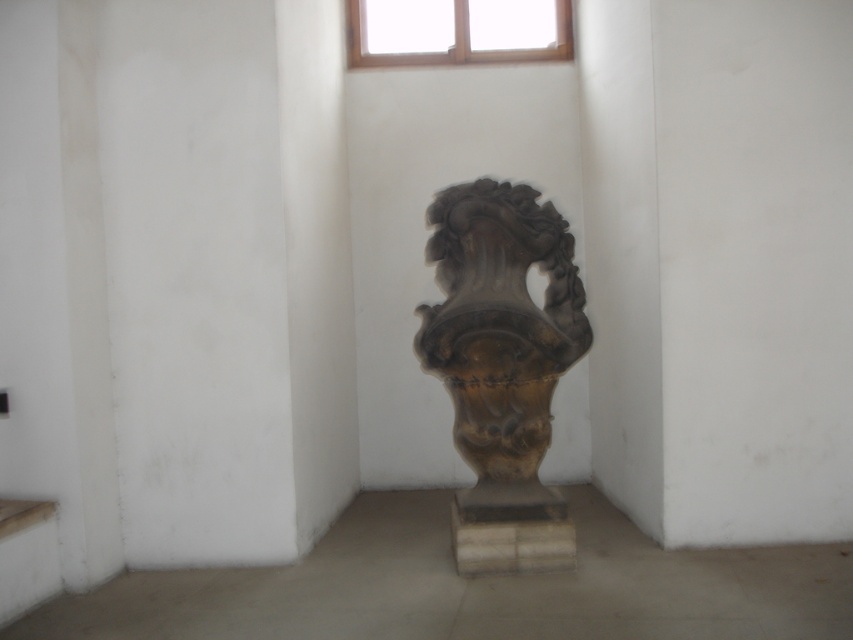
You are hanging a picture in a room. You see the brown stone vase at center and the wooden frame at upper center. Which object is located below the other?

The brown stone vase at center is positioned under the wooden frame at upper center, so the vase is below the frame.

You are an interior designer assessing the placement of the brown stone vase at center and the wooden frame at upper center in the room. Based on their sizes, which object would require more vertical space when hanging or placing?

The brown stone vase at center is taller than the wooden frame at upper center, so it would require more vertical space when placing it in the room.

You are an interior designer planning to move the brown stone vase at center closer to the wooden frame at upper center. The minimum distance required between these two items for safety is 7 feet. Is the current distance sufficient?

The brown stone vase at center is 8.01 feet from the wooden frame at upper center. Since the required minimum distance is 7 feet, the current distance of 8.01 feet is sufficient and exceeds the safety requirement.